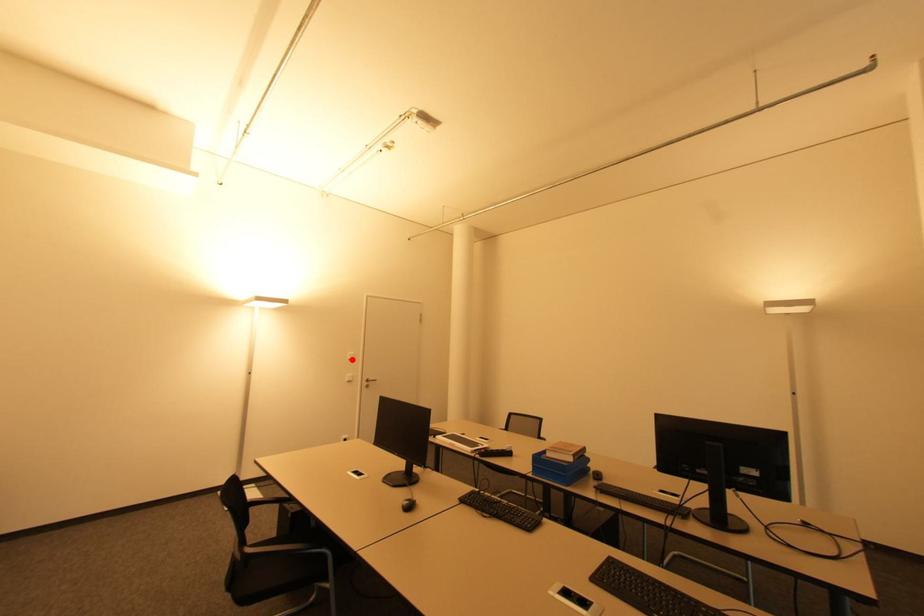
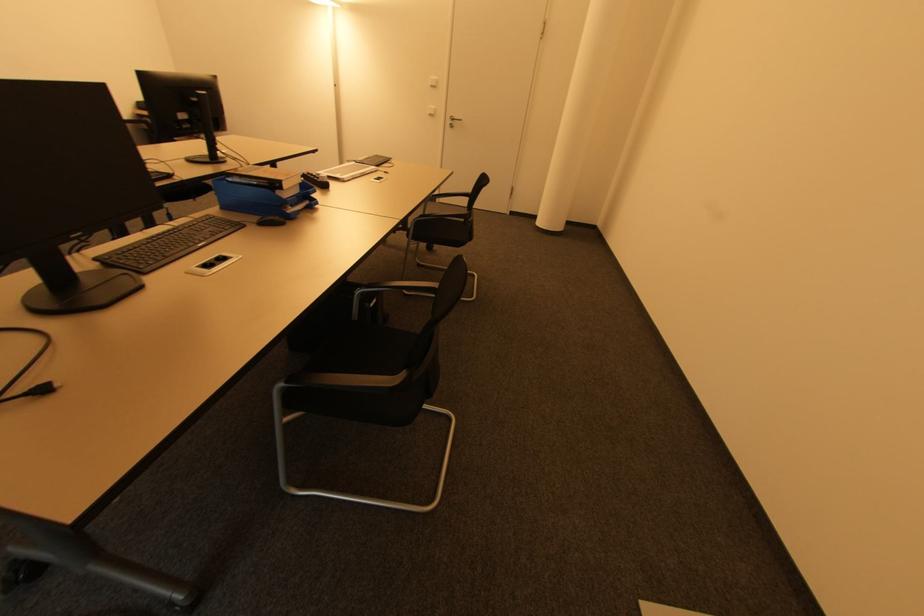
Question: I am providing you with two images of the same scene from different viewpoints. Image1 has a red point marked. In image2, the corresponding 3D location appears at what relative position? Reply with the corresponding letter.

Choices:
 (A) Closer
 (B) Farther

Answer: (A)